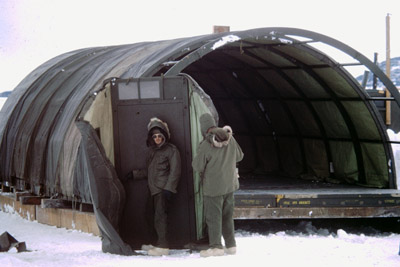
Find the location of a particular element. The height and width of the screenshot is (267, 400). metal door is located at coordinates pos(169,96).